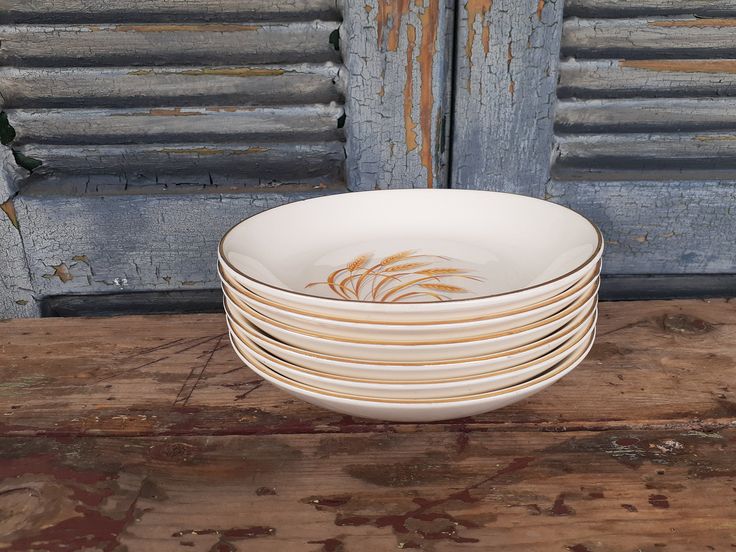
The image size is (736, 552). In order to click on dishes in this screenshot , I will do `click(403, 316)`, `click(403, 335)`, `click(402, 347)`, `click(399, 369)`, `click(397, 387)`, `click(400, 400)`.